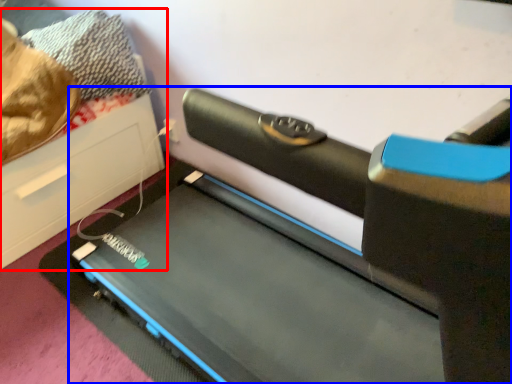
Question: Which object appears closest to the camera in this image, furniture (highlighted by a red box) or treadmill (highlighted by a blue box)?

Choices:
 (A) furniture
 (B) treadmill

Answer: (B)